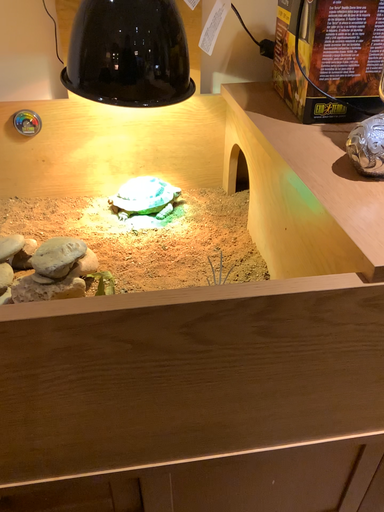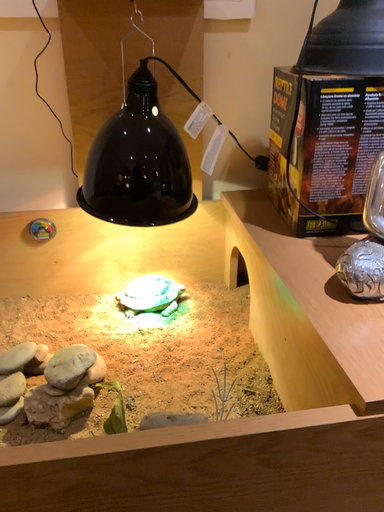
Question: Which way did the camera rotate in the video?

Choices:
 (A) rotated upward
 (B) rotated downward

Answer: (A)